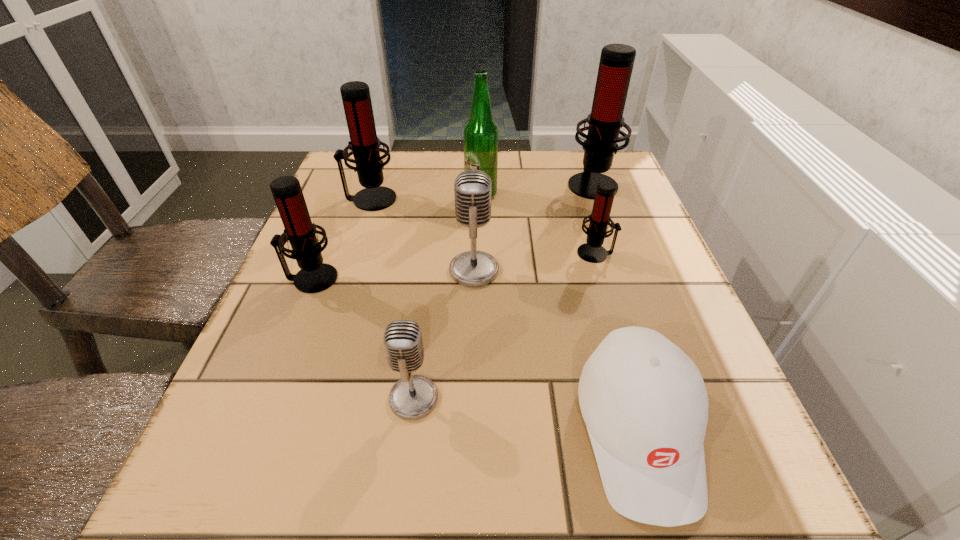
Where is `the shortest object`? the shortest object is located at coordinates (644, 402).

The image size is (960, 540). Identify the location of free region located 0.080m on the back of the tallest microphone. (582, 154).

Image resolution: width=960 pixels, height=540 pixels. Find the location of `vacant space located on the label of the green beer bottle`. vacant space located on the label of the green beer bottle is located at coordinates (481, 316).

At what (x,y) coordinates should I click in order to perform the action: click on vacant space located 0.240m on the front of the fifth shortest microphone. Please return your answer as a coordinate pair (x, y). This screenshot has height=540, width=960. Looking at the image, I should click on (343, 282).

At what (x,y) coordinates should I click in order to perform the action: click on blank space located 0.200m on the left of the third microphone from right to left. Please return your answer as a coordinate pair (x, y). The height and width of the screenshot is (540, 960). Looking at the image, I should click on (348, 270).

Where is `vacant space located on the right of the nearest red microphone`? vacant space located on the right of the nearest red microphone is located at coordinates (522, 279).

Where is `vacant space situated on the back of the smallest red microphone`? The image size is (960, 540). vacant space situated on the back of the smallest red microphone is located at coordinates (580, 200).

Where is `free space located on the back of the left gray microphone`? free space located on the back of the left gray microphone is located at coordinates (425, 304).

You are a GUI agent. You are given a task and a screenshot of the screen. Output one action in this format:
    pyautogui.click(x=<x>, y=<y>)
    Task: Click on the beer bottle that is positioned at the far edge
    
    Given the screenshot: What is the action you would take?
    [x=480, y=132]

Find the location of `object at the near edge`. object at the near edge is located at coordinates (644, 402).